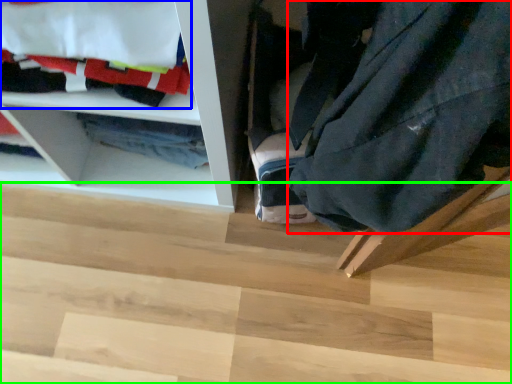
Question: Which object is the closest to the clothing (highlighted by a red box)? Choose among these: laundry (highlighted by a blue box) or stair (highlighted by a green box).

Choices:
 (A) laundry
 (B) stair

Answer: (A)